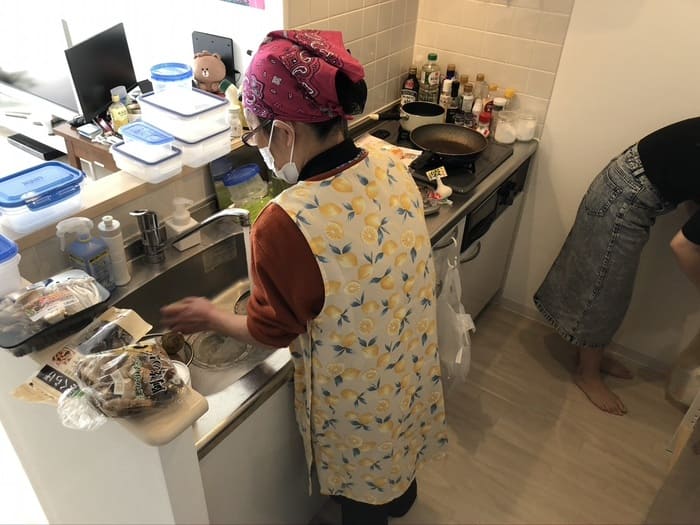
Locate an element on the screen. This screenshot has width=700, height=525. food containers is located at coordinates (14, 277), (19, 208), (155, 167), (146, 148), (201, 146), (201, 126), (173, 81).